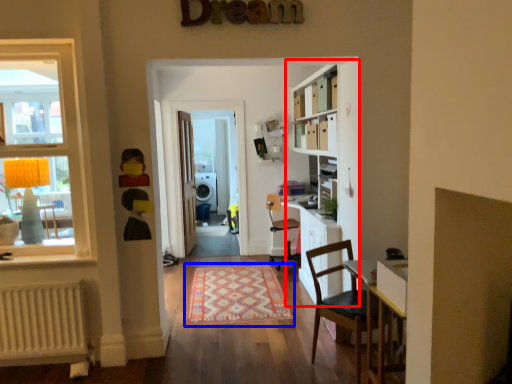
Question: Which point is closer to the camera, bookcase (highlighted by a red box) or mat (highlighted by a blue box)?

Choices:
 (A) bookcase
 (B) mat

Answer: (A)